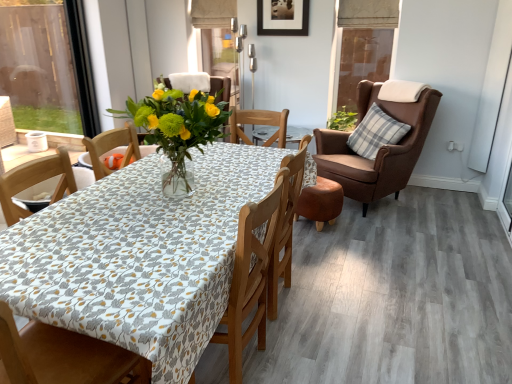
Where is `transparent glass window screen at upper right`? transparent glass window screen at upper right is located at coordinates (361, 47).

In the scene shown: Measure the distance between black matte picture frame at upper center and camera.

A distance of 3.99 meters exists between black matte picture frame at upper center and camera.

You are a GUI agent. You are given a task and a screenshot of the screen. Output one action in this format:
    pyautogui.click(x=<x>, y=<y>)
    Task: Click on the brown leather armchair at right, which is the 2th chair from left to right
    
    Given the screenshot: What is the action you would take?
    pyautogui.click(x=379, y=149)

The image size is (512, 384). I want to click on wooden chair at center, the 1th chair from the front, so click(251, 276).

The image size is (512, 384). Find the location of `transparent glass window screen at upper right`. transparent glass window screen at upper right is located at coordinates (361, 47).

Is translucent glass vase at center placed right next to transparent glass window screen at upper right?

translucent glass vase at center is not next to transparent glass window screen at upper right, and they're not touching.

Do you think translucent glass vase at center is within transparent glass window screen at upper right, or outside of it?

translucent glass vase at center is not inside transparent glass window screen at upper right, it's outside.

How much distance is there between translucent glass vase at center and transparent glass window screen at upper right?

They are 9.90 feet apart.

Looking at the image, does translucent glass vase at center seem bigger or smaller compared to transparent glass window screen at upper right?

In the image, translucent glass vase at center appears to be larger than transparent glass window screen at upper right.

Would you say transparent glass window screen at upper right is inside or outside translucent glass vase at center?

transparent glass window screen at upper right exists outside the volume of translucent glass vase at center.

Is transparent glass window screen at upper right positioned with its back to translucent glass vase at center?

No, translucent glass vase at center is not at the back of transparent glass window screen at upper right.

Can you confirm if transparent glass window screen at upper right is shorter than translucent glass vase at center?

No, transparent glass window screen at upper right is not shorter than translucent glass vase at center.

Considering the positions of objects green leafy plant at center and brown leather armchair at right, the first chair positioned from the back, in the image provided, who is more to the right, green leafy plant at center or brown leather armchair at right, the first chair positioned from the back,?

brown leather armchair at right, the first chair positioned from the back, is more to the right.

From a real-world perspective, starting from the green leafy plant at center, which chair is the 1st one below it? Please provide its 2D coordinates.

[(379, 149)]

From the image's perspective, which is above, green leafy plant at center or brown leather armchair at right, arranged as the second chair when viewed from the front?

From the image's view, green leafy plant at center is above.

Between wooden chair at center, arranged as the 2th chair when viewed from the right, and brown leather armchair at right, which is the 2th chair from left to right, which one has smaller width?

With smaller width is wooden chair at center, arranged as the 2th chair when viewed from the right.

From a real-world perspective, between wooden chair at center, the 1th chair from the front, and brown leather armchair at right, arranged as the second chair when viewed from the front, who is vertically higher?

brown leather armchair at right, arranged as the second chair when viewed from the front, from a real-world perspective.

Is point (252, 254) in front of point (364, 198)?

Yes.

Is wooden chair at center, the 1th chair from the front, aimed at brown leather armchair at right, which is the 2th chair from left to right?

No, wooden chair at center, the 1th chair from the front, does not turn towards brown leather armchair at right, which is the 2th chair from left to right.

From the picture: Is brown leather armchair at right, the first chair positioned from the back, facing towards green leafy plant at center?

No, brown leather armchair at right, the first chair positioned from the back, is not facing towards green leafy plant at center.

Measure the distance between brown leather armchair at right, arranged as the second chair when viewed from the front, and green leafy plant at center.

brown leather armchair at right, arranged as the second chair when viewed from the front, is 23.61 inches away from green leafy plant at center.

From a real-world perspective, which object rests below the other?

In real-world perspective, brown leather armchair at right, the 1th chair from the right, is lower.

Which of these two, brown leather armchair at right, arranged as the second chair when viewed from the front, or green leafy plant at center, is wider?

With larger width is brown leather armchair at right, arranged as the second chair when viewed from the front.

Is brown leather armchair at right, the first chair positioned from the back, inside or outside of plaid fabric pillow at right?

brown leather armchair at right, the first chair positioned from the back, lies outside plaid fabric pillow at right.

From a real-world perspective, count 1st chairs downward from the plaid fabric pillow at right and point to it. Please provide its 2D coordinates.

[(379, 149)]

From the image's perspective, relative to plaid fabric pillow at right, is brown leather armchair at right, which is the 2th chair from left to right, above or below?

From the image's perspective, brown leather armchair at right, which is the 2th chair from left to right, appears below plaid fabric pillow at right.

From a real-world perspective, between translucent glass vase at center and brown leather armchair at right, which is the 2th chair from left to right, who is vertically lower?

brown leather armchair at right, which is the 2th chair from left to right, is physically lower.

Is translucent glass vase at center placed right next to brown leather armchair at right, arranged as the second chair when viewed from the front?

No.

Which is in front, point (177, 157) or point (371, 175)?

The point (177, 157) is closer.

Considering the relative sizes of translucent glass vase at center and brown leather armchair at right, the 1th chair from the right, in the image provided, is translucent glass vase at center smaller than brown leather armchair at right, the 1th chair from the right,?

Correct, translucent glass vase at center occupies less space than brown leather armchair at right, the 1th chair from the right.

Image resolution: width=512 pixels, height=384 pixels. In order to click on floral arrangement that appears below the transparent glass window screen at upper right (from the image's perspective) in this screenshot , I will do `click(177, 130)`.

Find the location of a particular element. This screenshot has height=384, width=512. window screen that is behind the translucent glass vase at center is located at coordinates (361, 47).

Considering their positions, is brown leather armchair at right, which is the 2th chair from left to right, positioned closer to transparent glass window screen at upper right than translucent glass vase at center?

The object closer to transparent glass window screen at upper right is brown leather armchair at right, which is the 2th chair from left to right.

Estimate the real-world distances between objects in this image. Which object is closer to plaid fabric pillow at right, wooden chair at center, which ranks as the first chair in left-to-right order, or green leafy plant at center?

green leafy plant at center is positioned closer to the anchor plaid fabric pillow at right.

Estimate the real-world distances between objects in this image. Which object is closer to wooden chair at center, the second chair in the back-to-front sequence, plaid fabric pillow at right or black matte picture frame at upper center?

plaid fabric pillow at right is positioned closer to the anchor wooden chair at center, the second chair in the back-to-front sequence.

From the image, which object appears to be nearer to translucent glass vase at center, green leafy plant at center or plaid fabric pillow at right?

plaid fabric pillow at right is closer to translucent glass vase at center.

Looking at the image, which one is located further to plaid fabric pillow at right, brown leather armchair at right, the first chair positioned from the back, or translucent glass vase at center?

Based on the image, translucent glass vase at center appears to be further to plaid fabric pillow at right.

When comparing their distances from plaid fabric pillow at right, does green leafy plant at center or transparent glass window screen at upper right seem closer?

green leafy plant at center is closer to plaid fabric pillow at right.

Considering their positions, is brown leather armchair at right, which is the 2th chair from left to right, positioned further to wooden chair at center, arranged as the 2th chair when viewed from the right, than green leafy plant at center?

green leafy plant at center.

Estimate the real-world distances between objects in this image. Which object is further from green leafy plant at center, wooden chair at center, the 1th chair from the front, or transparent glass window screen at upper right?

wooden chair at center, the 1th chair from the front, lies further to green leafy plant at center than the other object.

You are a GUI agent. You are given a task and a screenshot of the screen. Output one action in this format:
    pyautogui.click(x=<x>, y=<y>)
    Task: Click on the pillow between brown leather armchair at right, arranged as the second chair when viewed from the front, and transparent glass window screen at upper right in the front-back direction
    
    Given the screenshot: What is the action you would take?
    pyautogui.click(x=376, y=133)

At what (x,y) coordinates should I click in order to perform the action: click on window screen between black matte picture frame at upper center and plaid fabric pillow at right vertically. Please return your answer as a coordinate pair (x, y). This screenshot has width=512, height=384. Looking at the image, I should click on (361, 47).

Locate an element on the screen. pillow between wooden chair at center, arranged as the 2th chair when viewed from the right, and transparent glass window screen at upper right, along the z-axis is located at coordinates (376, 133).

This screenshot has height=384, width=512. What are the coordinates of `chair between wooden chair at center, the 1th chair from the front, and green leafy plant at center, along the z-axis` in the screenshot? It's located at (x=379, y=149).